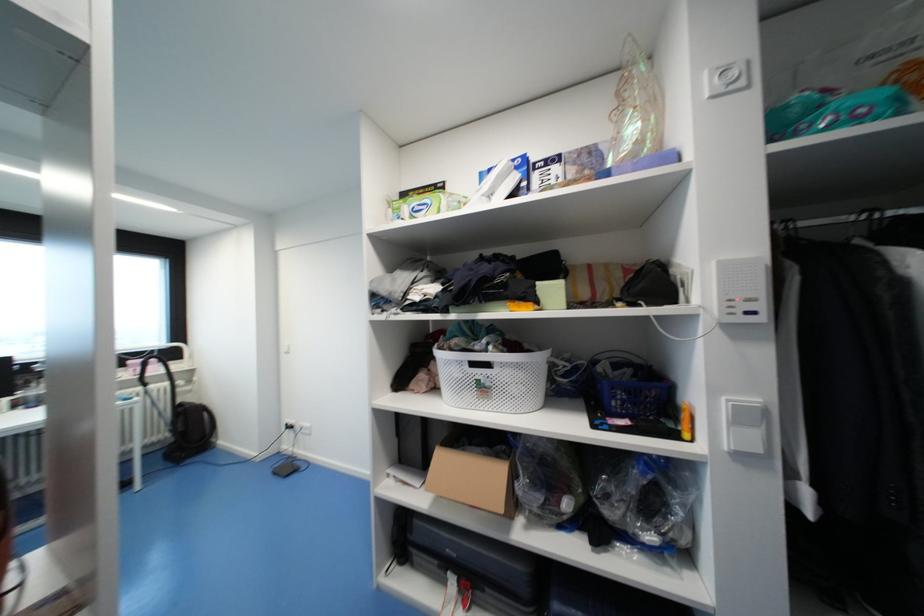
This screenshot has width=924, height=616. Describe the element at coordinates (152, 362) in the screenshot. I see `a vacuum cleaner handle` at that location.